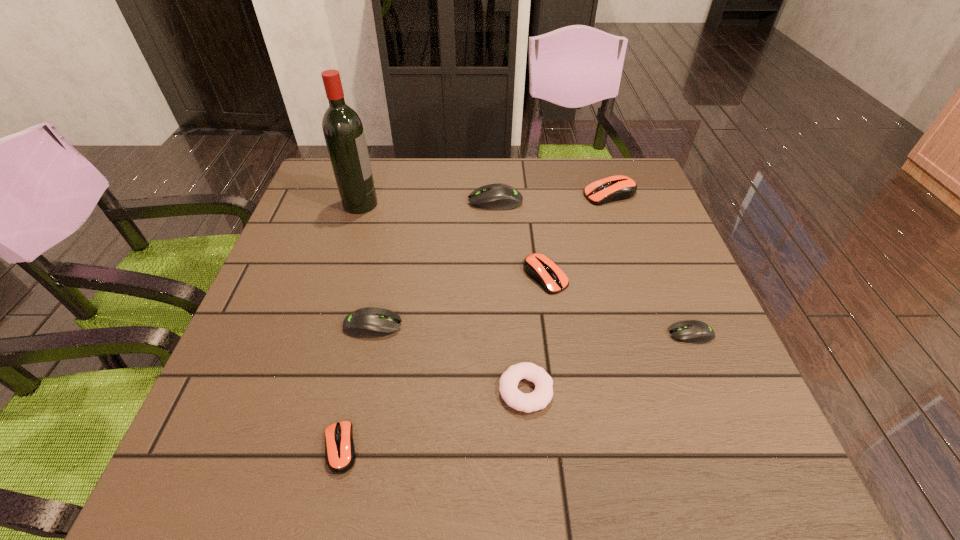
Where is `the second closest gray computer mouse to the rightmost gray computer mouse`? The image size is (960, 540). the second closest gray computer mouse to the rightmost gray computer mouse is located at coordinates (370, 322).

Identify which orange computer mouse is the nearest to the second farthest orange computer mouse. Please provide its 2D coordinates. Your answer should be formatted as a tuple, i.e. [(x, y)], where the tuple contains the x and y coordinates of a point satisfying the conditions above.

[(615, 188)]

Image resolution: width=960 pixels, height=540 pixels. Identify the location of the second closest orange computer mouse relative to the seventh farthest object. (340, 454).

This screenshot has width=960, height=540. I want to click on blank space that satisfies the following two spatial constraints: 1. on the front side of the farthest orange computer mouse; 2. on the wheel side of the biggest gray computer mouse, so click(612, 201).

Where is `free space that satisfies the following two spatial constraints: 1. on the front side of the biggest orange computer mouse; 2. on the wheel side of the farthest gray computer mouse`? free space that satisfies the following two spatial constraints: 1. on the front side of the biggest orange computer mouse; 2. on the wheel side of the farthest gray computer mouse is located at coordinates (612, 201).

The height and width of the screenshot is (540, 960). What are the coordinates of `free region that satisfies the following two spatial constraints: 1. on the wheel side of the second biggest gray computer mouse; 2. on the right side of the seventh farthest object` in the screenshot? It's located at (359, 390).

At what (x,y) coordinates should I click in order to perform the action: click on vacant space that satisfies the following two spatial constraints: 1. on the label of the fourth nearest computer mouse; 2. on the right side of the red wine bottle. Please return your answer as a coordinate pair (x, y). The width and height of the screenshot is (960, 540). Looking at the image, I should click on (338, 276).

Image resolution: width=960 pixels, height=540 pixels. In order to click on vacant area that satisfies the following two spatial constraints: 1. on the wheel side of the doughnut; 2. on the right side of the leftmost gray computer mouse in this screenshot , I will do `click(359, 390)`.

Image resolution: width=960 pixels, height=540 pixels. In order to click on free space that satisfies the following two spatial constraints: 1. on the front side of the farthest orange computer mouse; 2. on the wheel side of the leftmost gray computer mouse in this screenshot , I will do `click(656, 326)`.

This screenshot has width=960, height=540. Find the location of `vacant position in the image that satisfies the following two spatial constraints: 1. on the wheel side of the seventh farthest object; 2. on the right side of the leftmost gray computer mouse`. vacant position in the image that satisfies the following two spatial constraints: 1. on the wheel side of the seventh farthest object; 2. on the right side of the leftmost gray computer mouse is located at coordinates (359, 390).